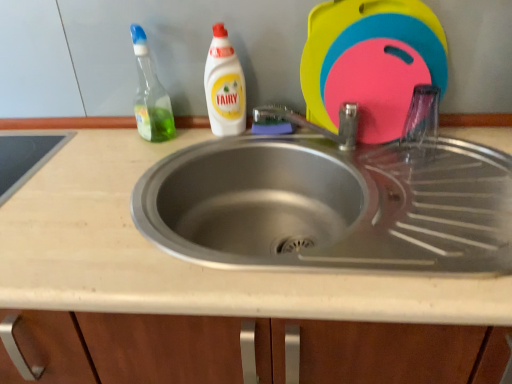
You are a GUI agent. You are given a task and a screenshot of the screen. Output one action in this format:
    pyautogui.click(x=<x>, y=<y>)
    Task: Click on the vacant region to the left of green translucent bottle at upper left, acting as the second cleaning product starting from the right
    
    Given the screenshot: What is the action you would take?
    94,141